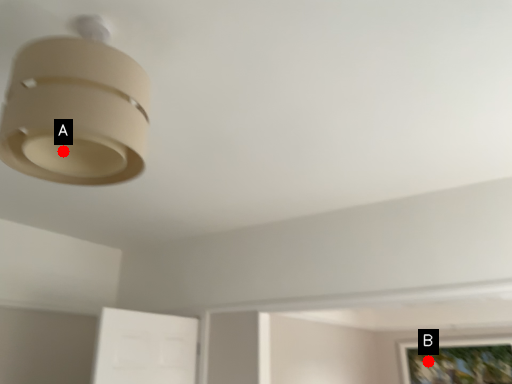
Question: Two points are circled on the image, labeled by A and B beside each circle. Which point is farther to the camera?

Choices:
 (A) A is further
 (B) B is further

Answer: (B)